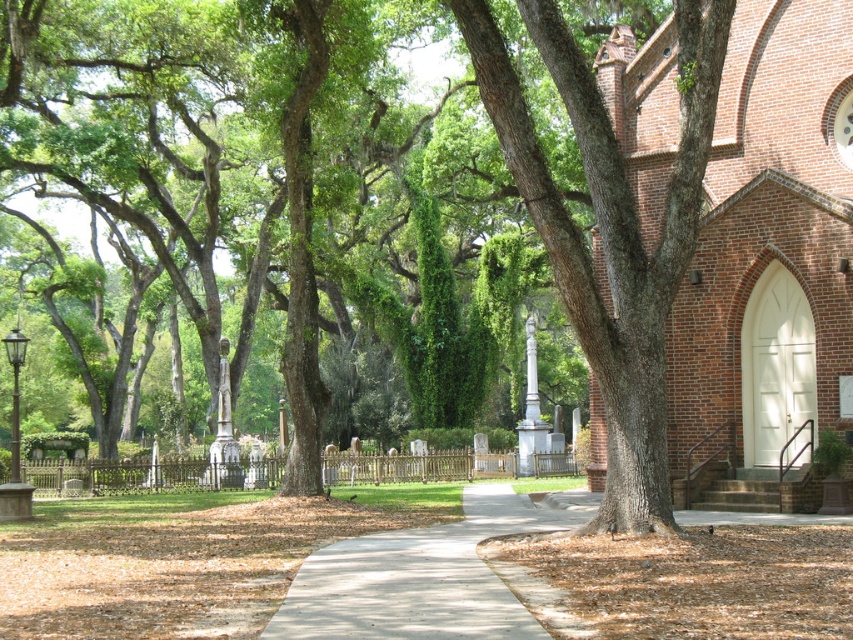
Is point (570, 67) closer to viewer compared to point (463, 618)?

No, (570, 67) is further to viewer.

Is smooth brown bark at center to the right of gray concrete sidewalk at center from the viewer's perspective?

Indeed, smooth brown bark at center is positioned on the right side of gray concrete sidewalk at center.

Between point (685, 136) and point (363, 593), which one is positioned in front?

Positioned in front is point (363, 593).

Locate an element on the screen. smooth brown bark at center is located at coordinates (610, 228).

Who is taller, brick church at center or smooth brown bark at center?

With more height is brick church at center.

Does brick church at center have a smaller size compared to smooth brown bark at center?

Actually, brick church at center might be larger than smooth brown bark at center.

Does point (775, 108) come behind point (556, 240)?

Yes, it is.

Identify the location of brick church at center. This screenshot has height=640, width=853. (769, 266).

Does brick church at center have a smaller size compared to gray concrete sidewalk at center?

No.

At what (x,y) coordinates should I click in order to perform the action: click on brick church at center. Please return your answer as a coordinate pair (x, y). The height and width of the screenshot is (640, 853). Looking at the image, I should click on (769, 266).

Does point (785, 211) lie in front of point (418, 532)?

No, (785, 211) is further to viewer.

Locate an element on the screen. The height and width of the screenshot is (640, 853). brick church at center is located at coordinates (769, 266).